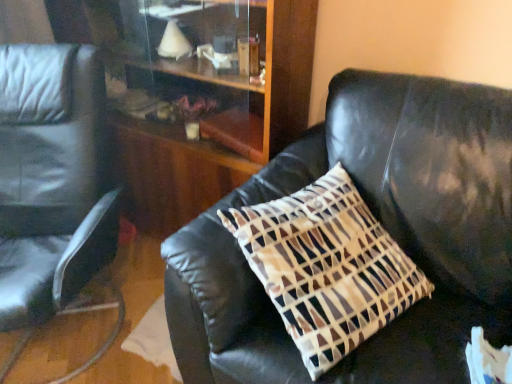
Question: Is matte black chair at left outside velvet brown pillow at center?

Choices:
 (A) yes
 (B) no

Answer: (A)

Question: From the image's perspective, is matte black chair at left over velvet brown pillow at center?

Choices:
 (A) no
 (B) yes

Answer: (B)

Question: Is matte black chair at left closer to the viewer compared to velvet brown pillow at center?

Choices:
 (A) yes
 (B) no

Answer: (B)

Question: Is matte black chair at left bigger than velvet brown pillow at center?

Choices:
 (A) no
 (B) yes

Answer: (B)

Question: Is matte black chair at left positioned with its back to velvet brown pillow at center?

Choices:
 (A) no
 (B) yes

Answer: (A)

Question: Is matte black chair at left wider or thinner than wooden dresser at center?

Choices:
 (A) thin
 (B) wide

Answer: (B)

Question: From the image's perspective, is matte black chair at left located above or below wooden dresser at center?

Choices:
 (A) below
 (B) above

Answer: (A)

Question: From a real-world perspective, is matte black chair at left positioned above or below wooden dresser at center?

Choices:
 (A) above
 (B) below

Answer: (B)

Question: From their relative heights in the image, would you say matte black chair at left is taller or shorter than wooden dresser at center?

Choices:
 (A) short
 (B) tall

Answer: (A)

Question: Is point coord(269,23) closer or farther from the camera than point coord(64,165)?

Choices:
 (A) farther
 (B) closer

Answer: (B)

Question: Is wooden dresser at center inside or outside of matte black chair at left?

Choices:
 (A) outside
 (B) inside

Answer: (A)

Question: From their relative heights in the image, would you say wooden dresser at center is taller or shorter than matte black chair at left?

Choices:
 (A) tall
 (B) short

Answer: (A)

Question: From a real-world perspective, is wooden dresser at center physically located above or below matte black chair at left?

Choices:
 (A) above
 (B) below

Answer: (A)

Question: From the image's perspective, is velvet brown pillow at center above or below wooden dresser at center?

Choices:
 (A) above
 (B) below

Answer: (B)

Question: Is velvet brown pillow at center wider or thinner than wooden dresser at center?

Choices:
 (A) wide
 (B) thin

Answer: (A)